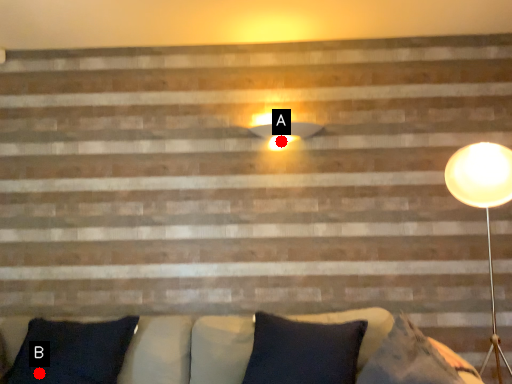
Question: Two points are circled on the image, labeled by A and B beside each circle. Among these points, which one is nearest to the camera?

Choices:
 (A) A is closer
 (B) B is closer

Answer: (B)